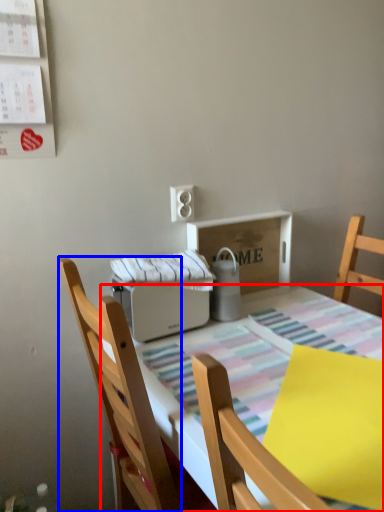
Question: Which object appears farthest to the camera in this image, kitchen & dining room table (highlighted by a red box) or chair (highlighted by a blue box)?

Choices:
 (A) kitchen & dining room table
 (B) chair

Answer: (B)